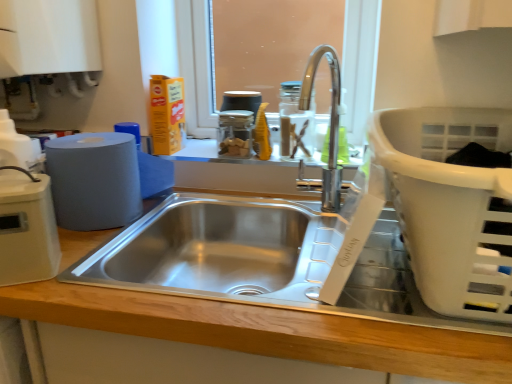
Locate an element on the screen. vacant area to the left of transparent glass jar at center, the second appliance from the front is located at coordinates (199, 155).